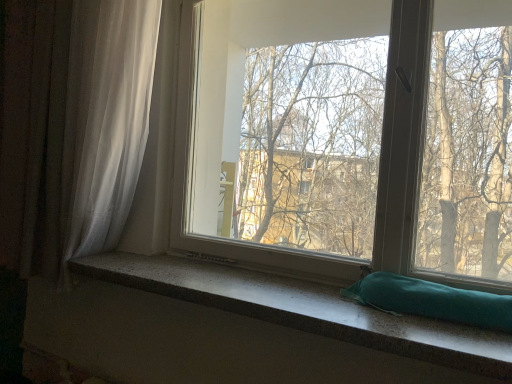
Image resolution: width=512 pixels, height=384 pixels. Find the location of `free space above granite-like teal pillow at lower center (from a real-world perspective)`. free space above granite-like teal pillow at lower center (from a real-world perspective) is located at coordinates (220, 278).